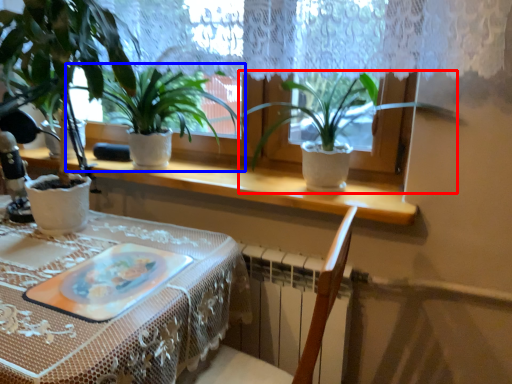
Question: Among these objects, which one is farthest to the camera, houseplant (highlighted by a red box) or houseplant (highlighted by a blue box)?

Choices:
 (A) houseplant
 (B) houseplant

Answer: (B)